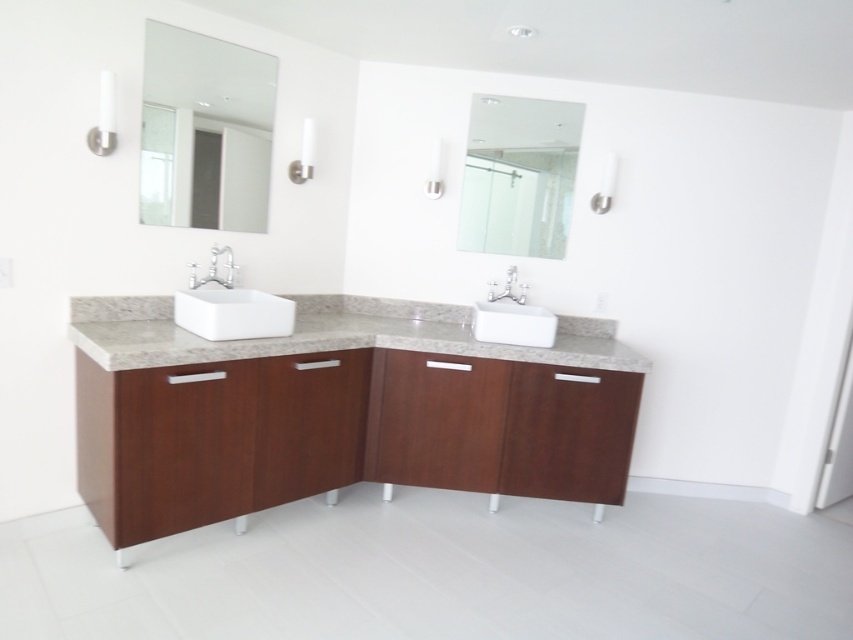
You are standing in the bathroom and want to check your reflection in the clear glass mirror at upper center. Where should you look to see your reflection?

You should look at the clear glass mirror at upper center located at point (518, 176) to see your reflection.

You are a professional photographer setting up a shoot in this bathroom. You want to capture the clear glass mirror at upper center in focus while keeping the rest of the scene slightly blurred. Given that your camera has a depth of field range of 10 feet, will the mirror be in focus?

The clear glass mirror at upper center is 10.53 feet away from the camera, which is just beyond the camera depth of field range of 10 feet. Therefore, the mirror will not be in focus.